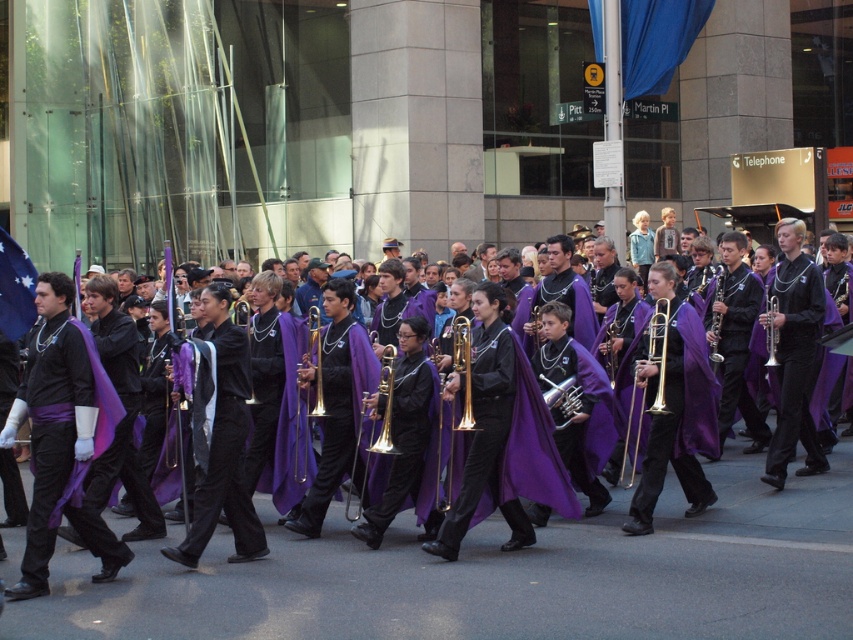
You are a parade attendee observing the musicians. Which trumpet, the shiny gold trumpet at center or the gold brass trumpet at center, is narrower in width?

The shiny gold trumpet at center is narrower in width compared to the gold brass trumpet at center.

You are a photographer standing in front of the marching band. You want to take a photo that focuses on the purple matte cape at center and the black matte trumpet at center. Which object will appear larger in the photo?

The purple matte cape at center will appear larger in the photo because it is closer to the viewer than the black matte trumpet at center.

You are a photographer standing at the origin point of the image coordinate system. You want to capture a closeup shot of the purple matte cape at center. What are the coordinates where you should focus your camera?

The coordinates to focus on are 0.887 in the x direction and 0.597 in the y direction.